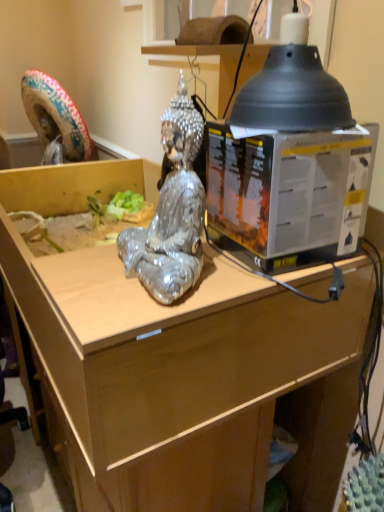
Question: Does shiny metallic statue at center have a greater width compared to wooden desk at center?

Choices:
 (A) no
 (B) yes

Answer: (A)

Question: From the image's perspective, is shiny metallic statue at center located above wooden desk at center?

Choices:
 (A) no
 (B) yes

Answer: (B)

Question: Is shiny metallic statue at center facing away from wooden desk at center?

Choices:
 (A) yes
 (B) no

Answer: (B)

Question: Would you consider shiny metallic statue at center to be distant from wooden desk at center?

Choices:
 (A) yes
 (B) no

Answer: (B)

Question: Considering the relative positions of shiny metallic statue at center and wooden desk at center in the image provided, is shiny metallic statue at center to the left of wooden desk at center from the viewer's perspective?

Choices:
 (A) yes
 (B) no

Answer: (B)

Question: From the image's perspective, is shiny metallic statue at center below wooden desk at center?

Choices:
 (A) yes
 (B) no

Answer: (B)

Question: Considering the relative sizes of shiny metallic statue at center and metallic plastic box at center in the image provided, is shiny metallic statue at center smaller than metallic plastic box at center?

Choices:
 (A) no
 (B) yes

Answer: (B)

Question: From the image's perspective, does shiny metallic statue at center appear higher than metallic plastic box at center?

Choices:
 (A) no
 (B) yes

Answer: (A)

Question: Would you say shiny metallic statue at center contains metallic plastic box at center?

Choices:
 (A) no
 (B) yes

Answer: (A)

Question: Is the surface of shiny metallic statue at center in direct contact with metallic plastic box at center?

Choices:
 (A) yes
 (B) no

Answer: (B)

Question: Considering the relative positions of shiny metallic statue at center and metallic plastic box at center in the image provided, is shiny metallic statue at center to the right of metallic plastic box at center from the viewer's perspective?

Choices:
 (A) no
 (B) yes

Answer: (A)

Question: Is metallic plastic box at center at the back of shiny metallic statue at center?

Choices:
 (A) yes
 (B) no

Answer: (A)

Question: From the image's perspective, is wooden desk at center on top of metallic plastic box at center?

Choices:
 (A) no
 (B) yes

Answer: (A)